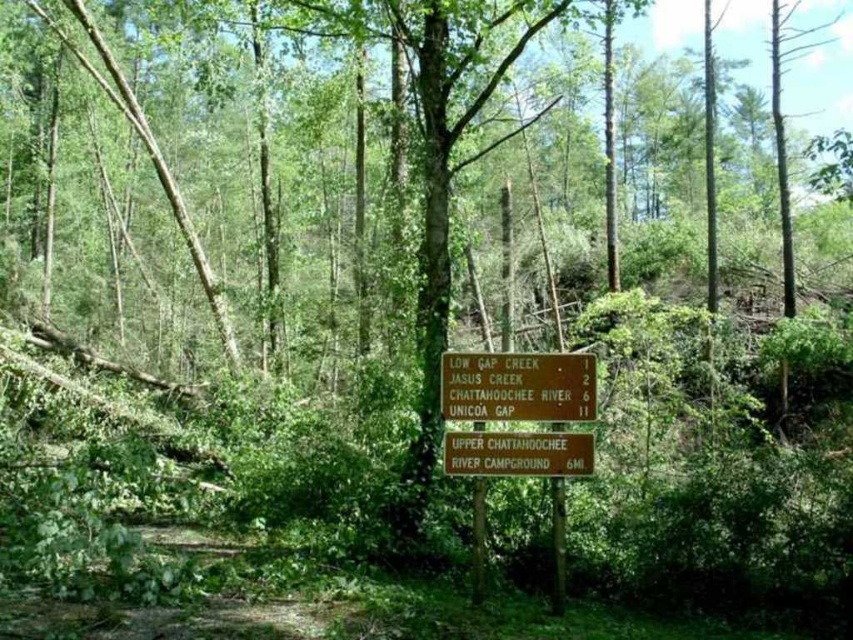
Question: Is brown wooden sign at center thinner than green wooden sign at center?

Choices:
 (A) no
 (B) yes

Answer: (A)

Question: Which of the following is the closest to the observer?

Choices:
 (A) brown wooden sign at center
 (B) green wooden sign at center

Answer: (A)

Question: From the image, what is the correct spatial relationship of brown wooden sign at center in relation to green wooden sign at center?

Choices:
 (A) right
 (B) left

Answer: (B)

Question: Is the position of brown wooden sign at center more distant than that of green wooden sign at center?

Choices:
 (A) no
 (B) yes

Answer: (A)

Question: Which point is farther to the camera?

Choices:
 (A) brown wooden sign at center
 (B) green wooden sign at center

Answer: (B)